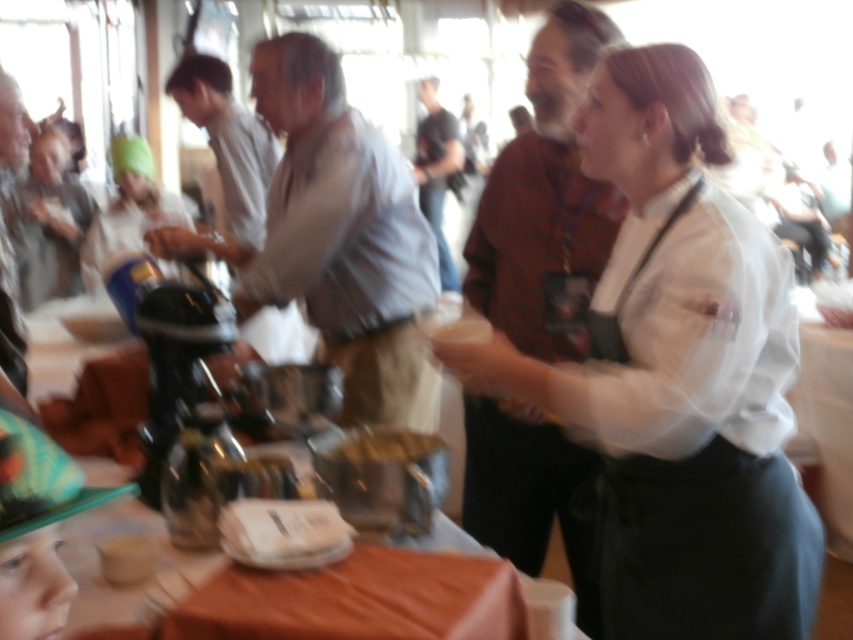
Can you confirm if light brown striped shirt at center is positioned above gray fabric at left?

No.

Who is higher up, light brown striped shirt at center or gray fabric at left?

Positioned higher is gray fabric at left.

Between point (252, 307) and point (21, 154), which one is positioned in front?

Point (252, 307) is more forward.

Locate an element on the screen. The height and width of the screenshot is (640, 853). light brown striped shirt at center is located at coordinates (337, 237).

Does light brown striped shirt at center appear on the left side of light brown wood table at center?

Incorrect, light brown striped shirt at center is not on the left side of light brown wood table at center.

Who is more distant from viewer, (276, 294) or (199, 243)?

The point (199, 243) is behind.

Describe the element at coordinates (337, 237) in the screenshot. The image size is (853, 640). I see `light brown striped shirt at center` at that location.

The width and height of the screenshot is (853, 640). Identify the location of light brown striped shirt at center. 337,237.

Is plaid shirt at center smaller than orange fabric tablecloth at lower center?

No, plaid shirt at center is not smaller than orange fabric tablecloth at lower center.

Who is higher up, plaid shirt at center or orange fabric tablecloth at lower center?

plaid shirt at center is above.

Between point (505, 300) and point (508, 632), which one is positioned behind?

The point (505, 300) is behind.

Locate an element on the screen. The width and height of the screenshot is (853, 640). plaid shirt at center is located at coordinates (544, 202).